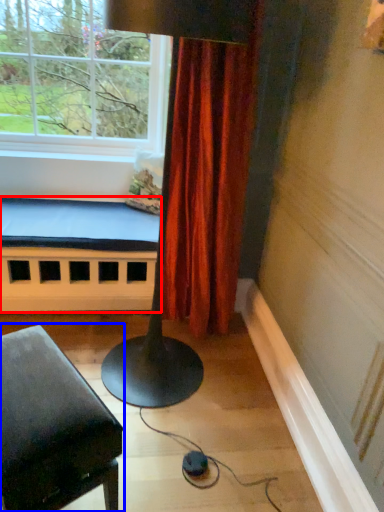
Question: Which object appears closest to the camera in this image, bed frame (highlighted by a red box) or furniture (highlighted by a blue box)?

Choices:
 (A) bed frame
 (B) furniture

Answer: (B)